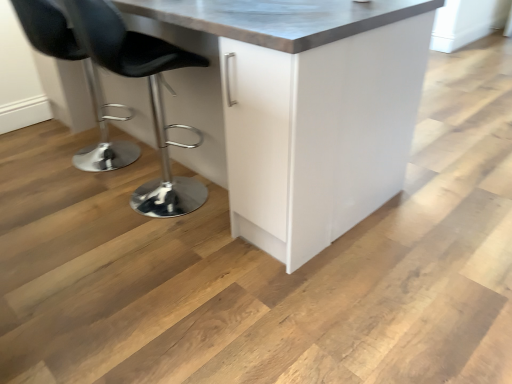
Question: Can you confirm if black leather stool at left, arranged as the 2th chair when viewed from the left, is wider than white glossy cabinet at center?

Choices:
 (A) no
 (B) yes

Answer: (A)

Question: Is black leather stool at left, arranged as the 2th chair when viewed from the left, next to white glossy cabinet at center?

Choices:
 (A) yes
 (B) no

Answer: (B)

Question: Is black leather stool at left, arranged as the 2th chair when viewed from the left, at the left side of white glossy cabinet at center?

Choices:
 (A) yes
 (B) no

Answer: (A)

Question: Is black leather stool at left, arranged as the first chair when viewed from the right, positioned far away from white glossy cabinet at center?

Choices:
 (A) no
 (B) yes

Answer: (A)

Question: From the image's perspective, would you say black leather stool at left, arranged as the first chair when viewed from the right, is shown under white glossy cabinet at center?

Choices:
 (A) no
 (B) yes

Answer: (B)

Question: Can we say black leather stool at left, arranged as the first chair when viewed from the right, lies outside white glossy cabinet at center?

Choices:
 (A) no
 (B) yes

Answer: (A)

Question: Is black leather stool at left, the second chair viewed from the right, closer to camera compared to black leather stool at left, arranged as the 2th chair when viewed from the left?

Choices:
 (A) yes
 (B) no

Answer: (B)

Question: Can we say black leather stool at left, the second chair viewed from the right, lies outside black leather stool at left, arranged as the 2th chair when viewed from the left?

Choices:
 (A) yes
 (B) no

Answer: (A)

Question: Considering the relative sizes of black leather stool at left, the first chair in the left-to-right sequence, and black leather stool at left, arranged as the first chair when viewed from the right, in the image provided, is black leather stool at left, the first chair in the left-to-right sequence, taller than black leather stool at left, arranged as the first chair when viewed from the right,?

Choices:
 (A) no
 (B) yes

Answer: (A)

Question: Can you see black leather stool at left, the second chair viewed from the right, touching black leather stool at left, arranged as the first chair when viewed from the right?

Choices:
 (A) no
 (B) yes

Answer: (A)

Question: From a real-world perspective, is black leather stool at left, the second chair viewed from the right, located beneath black leather stool at left, arranged as the first chair when viewed from the right?

Choices:
 (A) no
 (B) yes

Answer: (B)

Question: Does black leather stool at left, the first chair in the left-to-right sequence, have a lesser width compared to black leather stool at left, arranged as the 2th chair when viewed from the left?

Choices:
 (A) no
 (B) yes

Answer: (B)

Question: Can you confirm if black leather stool at left, arranged as the first chair when viewed from the right, is wider than black leather stool at left, the second chair viewed from the right?

Choices:
 (A) no
 (B) yes

Answer: (B)